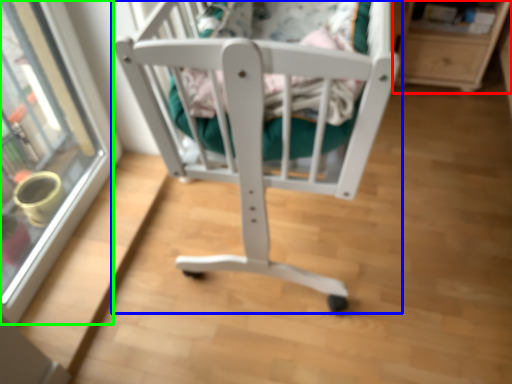
Question: Based on their relative distances, which object is nearer to shelf (highlighted by a red box)? Choose from furniture (highlighted by a blue box) and glass door (highlighted by a green box).

Choices:
 (A) furniture
 (B) glass door

Answer: (A)